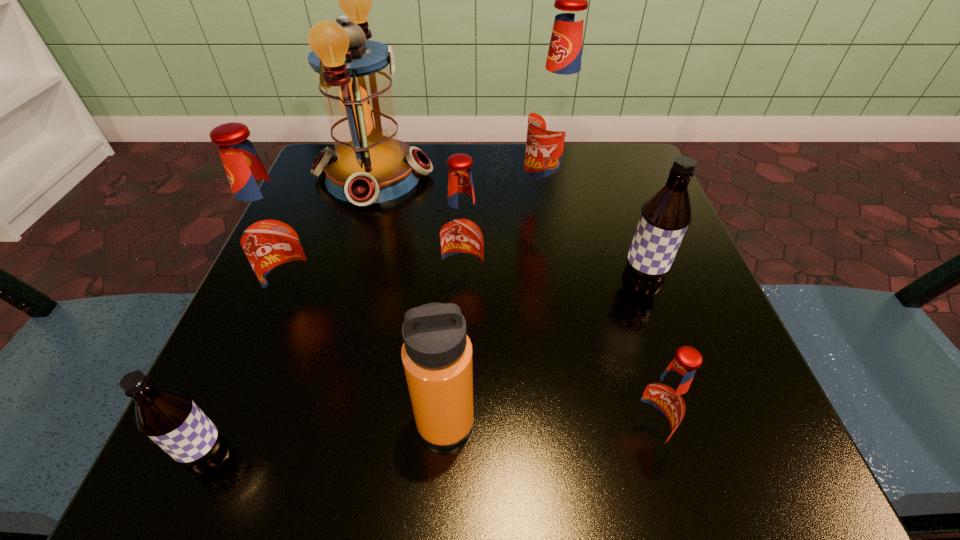
Identify the location of free location at the right edge. (731, 348).

Locate an element on the screen. This screenshot has height=540, width=960. free space at the far right corner of the desktop is located at coordinates click(609, 205).

This screenshot has width=960, height=540. In order to click on free space at the near right corner of the desktop in this screenshot , I will do `click(753, 447)`.

Identify the location of vacant space in between the second tallest root beer and the third red root beer from right to left. (384, 296).

Image resolution: width=960 pixels, height=540 pixels. In order to click on vacant region between the nearest red root beer and the thermos bottle in this screenshot , I will do `click(543, 430)`.

Find the location of `free spot between the orange thermos bottle and the farther brown root beer`. free spot between the orange thermos bottle and the farther brown root beer is located at coordinates (541, 356).

This screenshot has width=960, height=540. Identify the location of empty space that is in between the thermos bottle and the farthest red root beer. [495, 312].

Locate an element on the screen. free space between the nearer brown root beer and the thermos bottle is located at coordinates (329, 441).

Find the location of a particular element. The height and width of the screenshot is (540, 960). free area in between the farthest red root beer and the nearest red root beer is located at coordinates (594, 320).

The width and height of the screenshot is (960, 540). In order to click on free space between the right brown root beer and the third root beer from left to right in this screenshot , I will do [x=551, y=289].